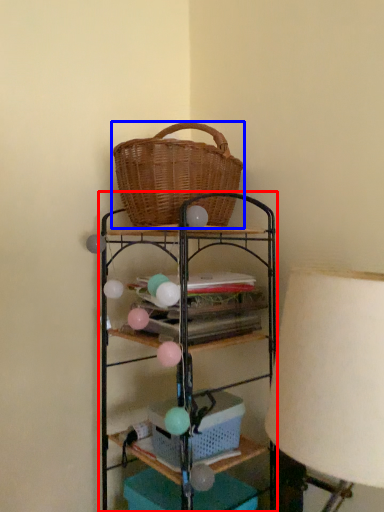
Question: Which object appears closest to the camera in this image, shelf (highlighted by a red box) or picnic basket (highlighted by a blue box)?

Choices:
 (A) shelf
 (B) picnic basket

Answer: (A)